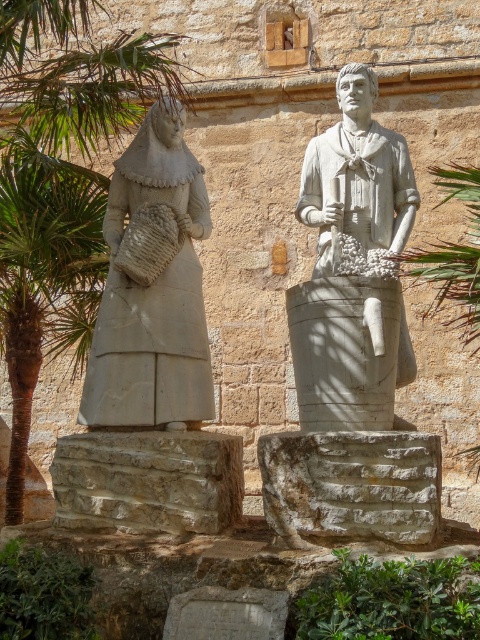
Question: Is white marble statue at left behind green leafy palm tree at left?

Choices:
 (A) yes
 (B) no

Answer: (B)

Question: Among these objects, which one is nearest to the camera?

Choices:
 (A) white stone statue at center
 (B) green leafy palm tree at left
 (C) white marble statue at left

Answer: (A)

Question: Among these objects, which one is nearest to the camera?

Choices:
 (A) white stone statue at center
 (B) green leafy palm tree at left
 (C) white marble statue at left

Answer: (A)

Question: Can you confirm if white marble statue at left is wider than green leafy palm tree at left?

Choices:
 (A) no
 (B) yes

Answer: (A)

Question: Which is farther from the white stone statue at center?

Choices:
 (A) green leafy palm tree at left
 (B) white marble statue at left

Answer: (A)

Question: Does white marble statue at left have a greater width compared to green leafy palm tree at left?

Choices:
 (A) yes
 (B) no

Answer: (B)